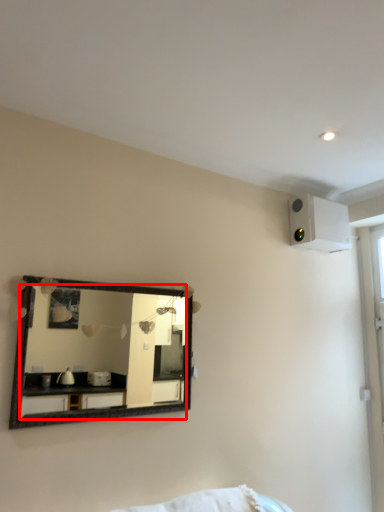
Question: From the image's perspective, what is the correct spatial relationship of mirror (annotated by the red box) in relation to air conditioning?

Choices:
 (A) below
 (B) above

Answer: (A)